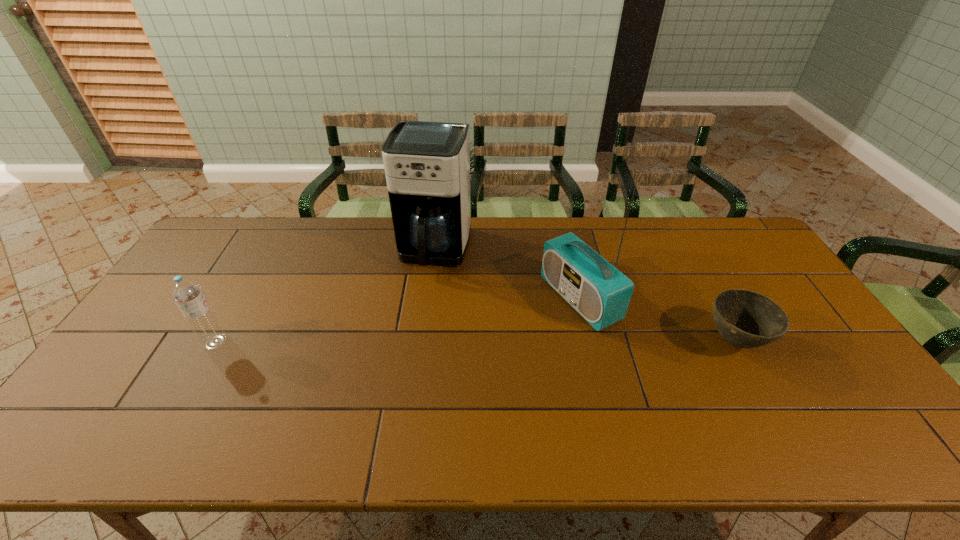
You are a GUI agent. You are given a task and a screenshot of the screen. Output one action in this format:
    pyautogui.click(x=<x>, y=<y>)
    Task: Click on the vacant space situated 0.140m on the front panel of the radio receiver
    The image size is (960, 540).
    Given the screenshot: What is the action you would take?
    pyautogui.click(x=511, y=334)

The height and width of the screenshot is (540, 960). What are the coordinates of `free space located on the front panel of the coffee maker` in the screenshot? It's located at (393, 382).

Find the location of a particular element. This screenshot has height=540, width=960. vacant area situated 0.050m on the front panel of the coffee maker is located at coordinates (423, 287).

I want to click on free point located on the front panel of the coffee maker, so click(410, 328).

What are the coordinates of `object that is at the far edge` in the screenshot? It's located at (427, 164).

This screenshot has height=540, width=960. What are the coordinates of `vacant space at the far edge` in the screenshot? It's located at (492, 249).

Where is `free region at the near edge`? free region at the near edge is located at coordinates (165, 386).

In the image, there is a desktop. At what (x,y) coordinates should I click in order to perform the action: click on vacant space at the left edge. Please return your answer as a coordinate pair (x, y). Looking at the image, I should click on (223, 284).

Where is `free spot at the right edge of the desktop`? Image resolution: width=960 pixels, height=540 pixels. free spot at the right edge of the desktop is located at coordinates (810, 342).

Find the location of a particular element. vacant area at the far left corner of the desktop is located at coordinates (231, 234).